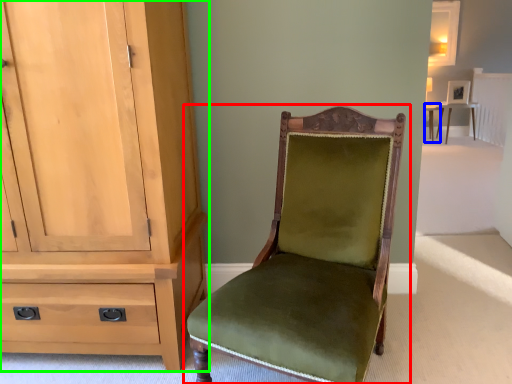
Question: Based on their relative distances, which object is farther from chair (highlighted by a red box)? Choose from table (highlighted by a blue box) and cabinetry (highlighted by a green box).

Choices:
 (A) table
 (B) cabinetry

Answer: (A)